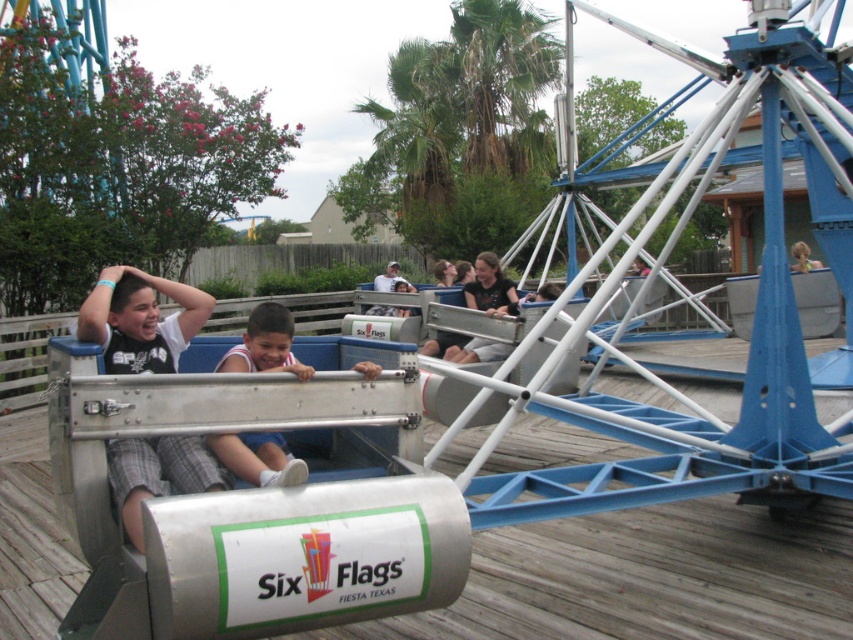
Question: Can you confirm if matte black shirt at left is wider than white jersey at center?

Choices:
 (A) no
 (B) yes

Answer: (A)

Question: Which point appears closest to the camera in this image?

Choices:
 (A) (134, 458)
 (B) (222, 364)

Answer: (A)

Question: Is matte black shirt at left in front of white jersey at center?

Choices:
 (A) yes
 (B) no

Answer: (A)

Question: From the image, what is the correct spatial relationship of matte black shirt at left in relation to white jersey at center?

Choices:
 (A) left
 (B) right

Answer: (A)